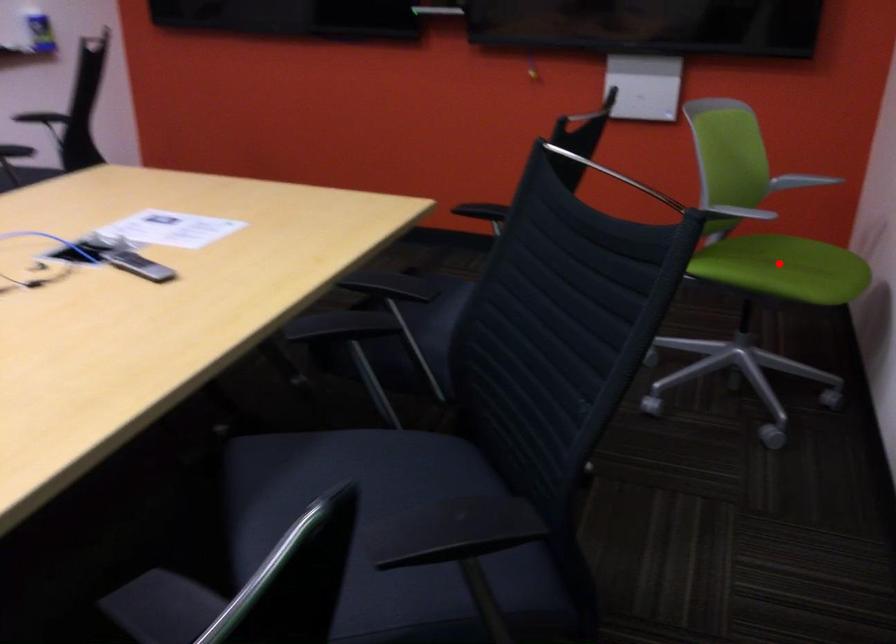
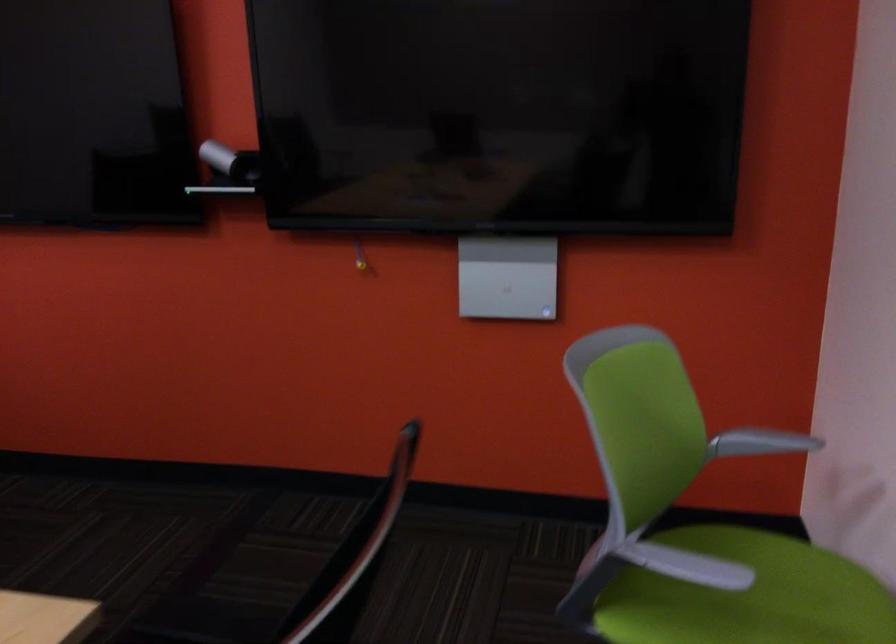
Question: I am providing you with two images of the same scene from different viewpoints. In image1, a red point is highlighted. Considering the same 3D point in image2, which of the following is correct?

Choices:
 (A) It is closer
 (B) It is farther

Answer: (A)